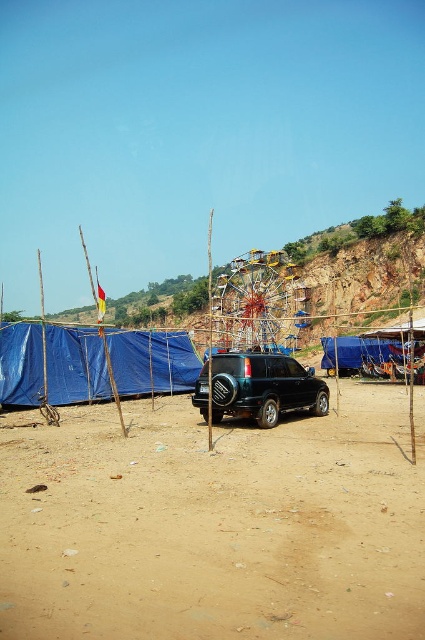
Is brown sandy ground at center bigger than satin black suv at center?

Yes.

Does brown sandy ground at center appear under satin black suv at center?

Correct, brown sandy ground at center is located below satin black suv at center.

Where is `brown sandy ground at center`? The width and height of the screenshot is (425, 640). brown sandy ground at center is located at coordinates (215, 525).

The height and width of the screenshot is (640, 425). I want to click on brown sandy ground at center, so click(x=215, y=525).

Who is shorter, blue tarpaulin tent at left or metallic yellow ferris wheel at center?

blue tarpaulin tent at left

Is blue tarpaulin tent at left in front of metallic yellow ferris wheel at center?

Yes, it is.

Where is `blue tarpaulin tent at left`? This screenshot has width=425, height=640. blue tarpaulin tent at left is located at coordinates (152, 362).

Between brown sandy ground at center and blue tarpaulin tent at left, which one appears on the left side from the viewer's perspective?

blue tarpaulin tent at left

Measure the distance between brown sandy ground at center and blue tarpaulin tent at left.

A: brown sandy ground at center is 21.88 meters from blue tarpaulin tent at left.

The height and width of the screenshot is (640, 425). In order to click on brown sandy ground at center in this screenshot , I will do `click(215, 525)`.